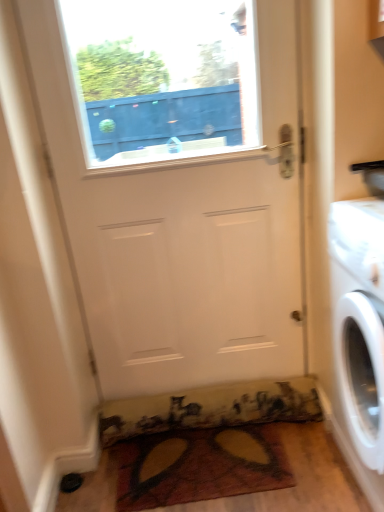
Based on the photo, how much space does multicolored fabric doormat at lower center, the second doormat in the bottom-to-top sequence, occupy horizontally?

multicolored fabric doormat at lower center, the second doormat in the bottom-to-top sequence, is 5.14 inches in width.

Where is `white glossy washing machine at right`? This screenshot has width=384, height=512. white glossy washing machine at right is located at coordinates (360, 334).

Which of these two, white glossy washing machine at right or multicolored fabric doormat at lower center, which is the second doormat from top to bottom, is bigger?

white glossy washing machine at right.

Is white glossy washing machine at right positioned beyond the bounds of multicolored fabric doormat at lower center, which is the second doormat from top to bottom?

Yes, white glossy washing machine at right is outside of multicolored fabric doormat at lower center, which is the second doormat from top to bottom.

Which object is further away from the camera, white glossy washing machine at right or multicolored fabric doormat at lower center, which appears as the first doormat when ordered from the bottom?

multicolored fabric doormat at lower center, which appears as the first doormat when ordered from the bottom.

From a real-world perspective, is white glossy washing machine at right physically located above or below multicolored fabric doormat at lower center, which is the second doormat from top to bottom?

white glossy washing machine at right is above multicolored fabric doormat at lower center, which is the second doormat from top to bottom.

Where is `door that is on the left side of multicolored fabric doormat at lower center, which appears as the first doormat when ordered from the bottom`? The image size is (384, 512). door that is on the left side of multicolored fabric doormat at lower center, which appears as the first doormat when ordered from the bottom is located at coordinates (177, 184).

Looking at this image, can you confirm if white matte door at center is positioned to the right of multicolored fabric doormat at lower center, which is the second doormat from top to bottom?

Incorrect, white matte door at center is not on the right side of multicolored fabric doormat at lower center, which is the second doormat from top to bottom.

Considering the sizes of objects white matte door at center and multicolored fabric doormat at lower center, which is the second doormat from top to bottom, in the image provided, who is wider, white matte door at center or multicolored fabric doormat at lower center, which is the second doormat from top to bottom,?

With larger width is multicolored fabric doormat at lower center, which is the second doormat from top to bottom.

Is multicolored fabric doormat at lower center, which is the second doormat from top to bottom, taller or shorter than white glossy washing machine at right?

Clearly, multicolored fabric doormat at lower center, which is the second doormat from top to bottom, is shorter compared to white glossy washing machine at right.

Is multicolored fabric doormat at lower center, which appears as the first doormat when ordered from the bottom, bigger or smaller than white glossy washing machine at right?

multicolored fabric doormat at lower center, which appears as the first doormat when ordered from the bottom, is smaller than white glossy washing machine at right.

How far apart are multicolored fabric doormat at lower center, which is the second doormat from top to bottom, and white glossy washing machine at right?

The distance of multicolored fabric doormat at lower center, which is the second doormat from top to bottom, from white glossy washing machine at right is 20.89 inches.

Where is `door above the white glossy washing machine at right (from a real-world perspective)`? This screenshot has height=512, width=384. door above the white glossy washing machine at right (from a real-world perspective) is located at coordinates (177, 184).

From the image's perspective, does white glossy washing machine at right appear higher than white matte door at center?

No, from the image's perspective, white glossy washing machine at right is not over white matte door at center.

Is white glossy washing machine at right bigger than white matte door at center?

Indeed, white glossy washing machine at right has a larger size compared to white matte door at center.

How many degrees apart are the facing directions of white glossy washing machine at right and white matte door at center?

87.4 degrees.

Which of these two, multicolored fabric doormat at lower center, which appears as the first doormat when ordered from the bottom, or white matte door at center, is wider?

multicolored fabric doormat at lower center, which appears as the first doormat when ordered from the bottom, is wider.

Does multicolored fabric doormat at lower center, which appears as the first doormat when ordered from the bottom, touch white matte door at center?

No, multicolored fabric doormat at lower center, which appears as the first doormat when ordered from the bottom, is not making contact with white matte door at center.

Between multicolored fabric doormat at lower center, which appears as the first doormat when ordered from the bottom, and white matte door at center, which one has smaller size?

A: multicolored fabric doormat at lower center, which appears as the first doormat when ordered from the bottom.

From a real-world perspective, between multicolored fabric doormat at lower center, which appears as the first doormat when ordered from the bottom, and white matte door at center, who is vertically higher?

white matte door at center.

Does multicolored fabric doormat at lower center, which appears as the first doormat when ordered from the bottom, touch multicolored fabric doormat at lower center, the first doormat from the top?

multicolored fabric doormat at lower center, which appears as the first doormat when ordered from the bottom, and multicolored fabric doormat at lower center, the first doormat from the top, are clearly separated.

Which object is closer to the camera taking this photo, multicolored fabric doormat at lower center, which is the second doormat from top to bottom, or multicolored fabric doormat at lower center, the second doormat in the bottom-to-top sequence?

multicolored fabric doormat at lower center, which is the second doormat from top to bottom, is in front.

Would you say multicolored fabric doormat at lower center, which is the second doormat from top to bottom, is inside or outside multicolored fabric doormat at lower center, the second doormat in the bottom-to-top sequence?

multicolored fabric doormat at lower center, which is the second doormat from top to bottom, exists outside the volume of multicolored fabric doormat at lower center, the second doormat in the bottom-to-top sequence.

Consider the image. Considering the sizes of objects white glossy washing machine at right and multicolored fabric doormat at lower center, the second doormat in the bottom-to-top sequence, in the image provided, who is thinner, white glossy washing machine at right or multicolored fabric doormat at lower center, the second doormat in the bottom-to-top sequence,?

With smaller width is multicolored fabric doormat at lower center, the second doormat in the bottom-to-top sequence.

Considering the relative positions of white glossy washing machine at right and multicolored fabric doormat at lower center, the first doormat from the top, in the image provided, is white glossy washing machine at right behind multicolored fabric doormat at lower center, the first doormat from the top,?

No, it is not.

Between white glossy washing machine at right and multicolored fabric doormat at lower center, the first doormat from the top, which one appears on the right side from the viewer's perspective?

white glossy washing machine at right is more to the right.

Who is bigger, white glossy washing machine at right or multicolored fabric doormat at lower center, the first doormat from the top?

white glossy washing machine at right is bigger.

Locate an element on the screen. The height and width of the screenshot is (512, 384). washing machine in front of the multicolored fabric doormat at lower center, which appears as the first doormat when ordered from the bottom is located at coordinates (360, 334).

Locate an element on the screen. The width and height of the screenshot is (384, 512). the 2nd doormat positioned below the white matte door at center (from the image's perspective) is located at coordinates [199, 466].

Estimate the real-world distances between objects in this image. Which object is closer to multicolored fabric doormat at lower center, the second doormat in the bottom-to-top sequence, white glossy washing machine at right or multicolored fabric doormat at lower center, which is the second doormat from top to bottom?

multicolored fabric doormat at lower center, which is the second doormat from top to bottom.

Based on their spatial positions, is multicolored fabric doormat at lower center, the first doormat from the top, or white glossy washing machine at right further from multicolored fabric doormat at lower center, which is the second doormat from top to bottom?

Based on the image, white glossy washing machine at right appears to be further to multicolored fabric doormat at lower center, which is the second doormat from top to bottom.

Looking at the image, which one is located closer to multicolored fabric doormat at lower center, which appears as the first doormat when ordered from the bottom, white matte door at center or multicolored fabric doormat at lower center, the second doormat in the bottom-to-top sequence?

multicolored fabric doormat at lower center, the second doormat in the bottom-to-top sequence.

Estimate the real-world distances between objects in this image. Which object is closer to multicolored fabric doormat at lower center, the second doormat in the bottom-to-top sequence, white matte door at center or multicolored fabric doormat at lower center, which appears as the first doormat when ordered from the bottom?

multicolored fabric doormat at lower center, which appears as the first doormat when ordered from the bottom, lies closer to multicolored fabric doormat at lower center, the second doormat in the bottom-to-top sequence, than the other object.

From the image, which object appears to be farther from white glossy washing machine at right, multicolored fabric doormat at lower center, the first doormat from the top, or white matte door at center?

The object further to white glossy washing machine at right is multicolored fabric doormat at lower center, the first doormat from the top.

Which object lies further to the anchor point white matte door at center, multicolored fabric doormat at lower center, which appears as the first doormat when ordered from the bottom, or multicolored fabric doormat at lower center, the second doormat in the bottom-to-top sequence?

multicolored fabric doormat at lower center, which appears as the first doormat when ordered from the bottom, is further to white matte door at center.

From the image, which object appears to be farther from multicolored fabric doormat at lower center, which is the second doormat from top to bottom, white glossy washing machine at right or multicolored fabric doormat at lower center, the second doormat in the bottom-to-top sequence?

white glossy washing machine at right.

Considering their positions, is white glossy washing machine at right positioned closer to white matte door at center than multicolored fabric doormat at lower center, which appears as the first doormat when ordered from the bottom?

white glossy washing machine at right is closer to white matte door at center.

Where is `door located between white glossy washing machine at right and multicolored fabric doormat at lower center, the second doormat in the bottom-to-top sequence, in the depth direction`? The width and height of the screenshot is (384, 512). door located between white glossy washing machine at right and multicolored fabric doormat at lower center, the second doormat in the bottom-to-top sequence, in the depth direction is located at coordinates (177, 184).

Identify the location of doormat that lies between white matte door at center and multicolored fabric doormat at lower center, which is the second doormat from top to bottom, from top to bottom. (211, 408).

The width and height of the screenshot is (384, 512). I want to click on doormat between white glossy washing machine at right and multicolored fabric doormat at lower center, the first doormat from the top, in the front-back direction, so click(x=199, y=466).

Where is `washing machine between white matte door at center and multicolored fabric doormat at lower center, which appears as the first doormat when ordered from the bottom, vertically`? washing machine between white matte door at center and multicolored fabric doormat at lower center, which appears as the first doormat when ordered from the bottom, vertically is located at coordinates (360, 334).